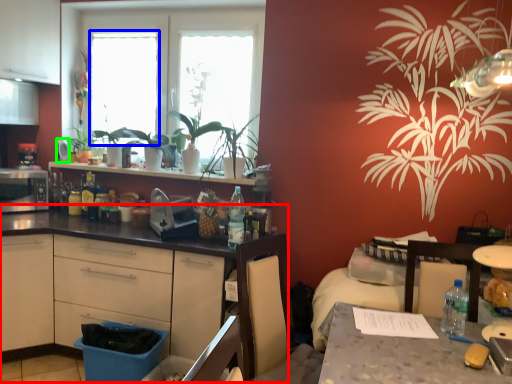
Question: Estimate the real-world distances between objects in this image. Which object is closer to countertop (highlighted by a red box), window screen (highlighted by a blue box) or appliance (highlighted by a green box)?

Choices:
 (A) window screen
 (B) appliance

Answer: (A)